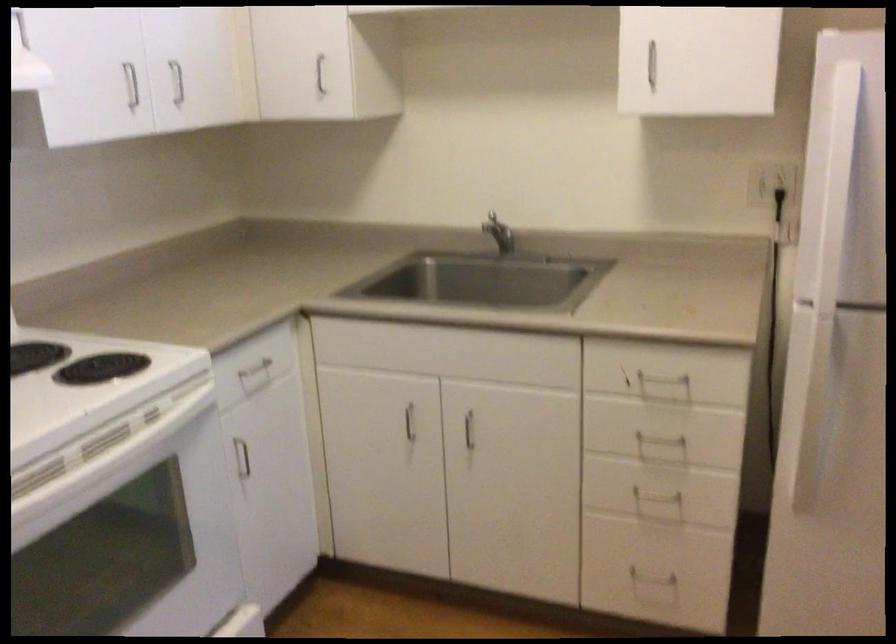
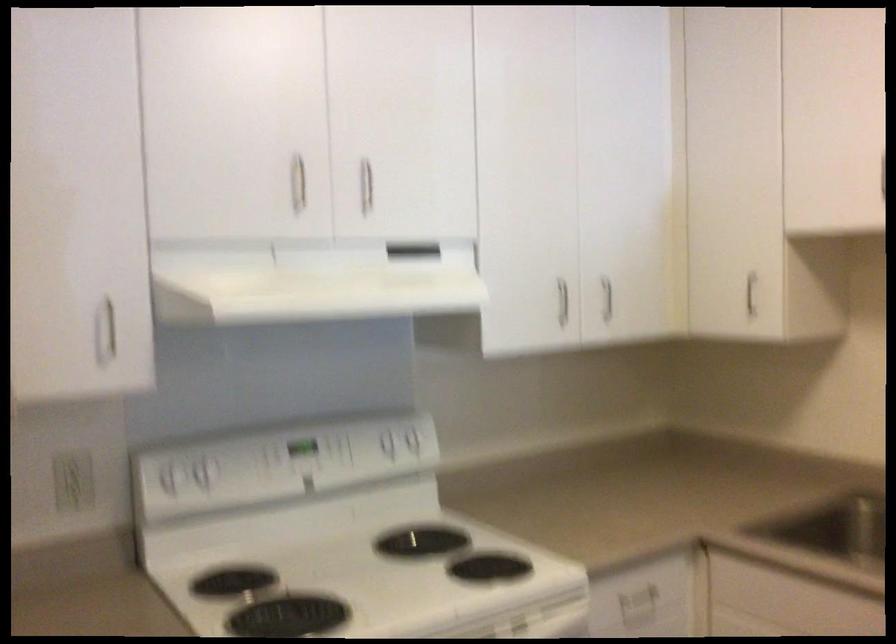
Find the pixel in the second image that matches point (170, 79) in the first image.

(607, 298)